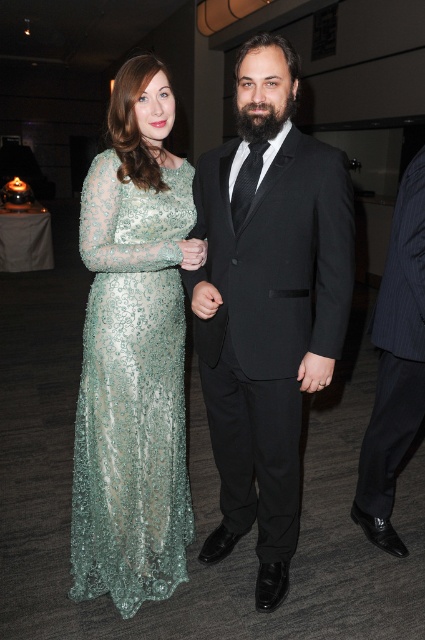
Question: Is black satin suit at center positioned at the back of green sequined dress at left?

Choices:
 (A) yes
 (B) no

Answer: (B)

Question: Does black satin suit at center have a larger size compared to green sequined dress at left?

Choices:
 (A) yes
 (B) no

Answer: (A)

Question: Which point is farther to the camera?

Choices:
 (A) pinstriped fabric suit at right
 (B) black satin suit at center
 (C) green sequined dress at left

Answer: (A)

Question: Based on their relative distances, which object is nearer to the green sequined dress at left?

Choices:
 (A) black satin suit at center
 (B) pinstriped fabric suit at right

Answer: (A)

Question: Which object is positioned closest to the green sequined dress at left?

Choices:
 (A) pinstriped fabric suit at right
 (B) black satin suit at center

Answer: (B)

Question: Observing the image, what is the correct spatial positioning of black satin suit at center in reference to pinstriped fabric suit at right?

Choices:
 (A) above
 (B) below

Answer: (A)